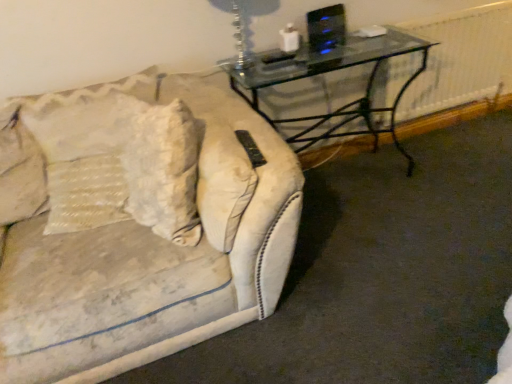
Question: In terms of width, does clear glass table lamp at upper center look wider or thinner when compared to white textured radiator at right?

Choices:
 (A) thin
 (B) wide

Answer: (B)

Question: Is clear glass table lamp at upper center inside or outside of white textured radiator at right?

Choices:
 (A) inside
 (B) outside

Answer: (B)

Question: Estimate the real-world distances between objects in this image. Which object is farther from the white textured pillow at left?

Choices:
 (A) transparent glass table at upper right
 (B) white textured radiator at right
 (C) clear glass table lamp at upper center

Answer: (B)

Question: Estimate the real-world distances between objects in this image. Which object is closer to the white textured pillow at left?

Choices:
 (A) clear glass table lamp at upper center
 (B) transparent glass table at upper right
 (C) white textured radiator at right

Answer: (A)